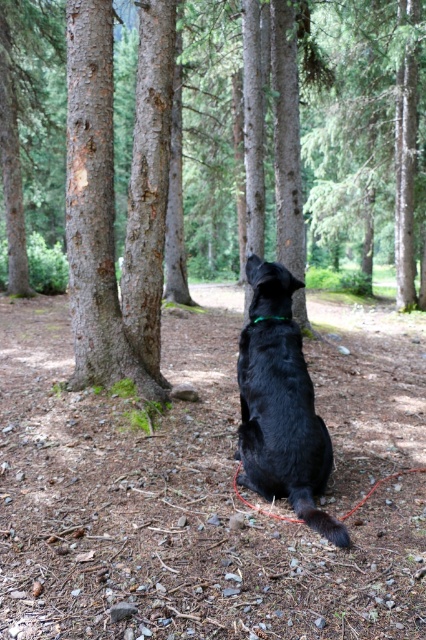
Who is positioned more to the right, rough bark trees at left or green fabric neckband at center?

green fabric neckband at center is more to the right.

Does point (141, 131) come behind point (270, 314)?

Yes, it is behind point (270, 314).

Between point (108, 316) and point (255, 321), which one is positioned in front?

Point (255, 321)

This screenshot has width=426, height=640. What are the coordinates of `rough bark trees at left` in the screenshot? It's located at pyautogui.click(x=112, y=198).

Is rough bark trees at left to the right of shiny black dog at center from the viewer's perspective?

No, rough bark trees at left is not to the right of shiny black dog at center.

Looking at this image, is rough bark trees at left smaller than shiny black dog at center?

Incorrect, rough bark trees at left is not smaller in size than shiny black dog at center.

Is point (89, 84) positioned before point (333, 524)?

No, it is behind (333, 524).

Find the location of a particular element. The width and height of the screenshot is (426, 640). rough bark trees at left is located at coordinates (112, 198).

Is shiny black dog at center wider than green fabric neckband at center?

Yes, shiny black dog at center is wider than green fabric neckband at center.

Is point (317, 474) farther from viewer compared to point (268, 316)?

No, (317, 474) is closer to viewer.

You are a GUI agent. You are given a task and a screenshot of the screen. Output one action in this format:
    pyautogui.click(x=<x>, y=<y>)
    Task: Click on the shiny black dog at center
    
    Given the screenshot: What is the action you would take?
    pyautogui.click(x=281, y=404)